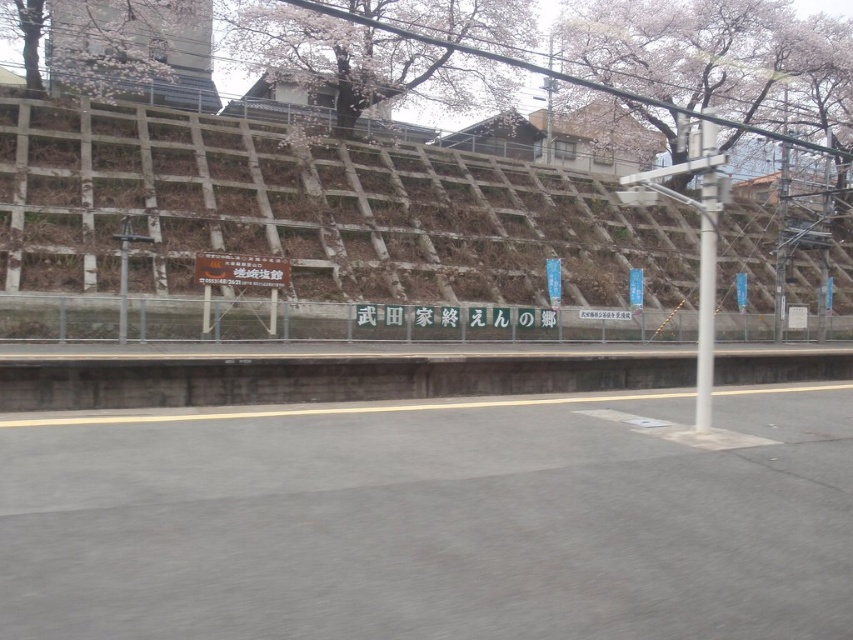
Does brown textured wall at upper center have a lesser width compared to slightly fuzzy cherry blossom at upper center?

Incorrect, brown textured wall at upper center's width is not less than slightly fuzzy cherry blossom at upper center's.

Who is higher up, brown textured wall at upper center or slightly fuzzy cherry blossom at upper center?

slightly fuzzy cherry blossom at upper center

This screenshot has height=640, width=853. What are the coordinates of `brown textured wall at upper center` in the screenshot? It's located at coord(315,212).

Between point (642, 109) and point (712, 204), which one is positioned in front?

Positioned in front is point (712, 204).

Who is higher up, slightly fuzzy cherry blossom at upper center or white metallic pole at center?

slightly fuzzy cherry blossom at upper center is higher up.

Where is `slightly fuzzy cherry blossom at upper center`? The width and height of the screenshot is (853, 640). slightly fuzzy cherry blossom at upper center is located at coordinates (701, 49).

This screenshot has width=853, height=640. I want to click on slightly fuzzy cherry blossom at upper center, so click(701, 49).

Which of these two, slightly fuzzy cherry blossom at upper center or slightly glossy wood at upper left, stands taller?

slightly fuzzy cherry blossom at upper center is taller.

Measure the distance between slightly fuzzy cherry blossom at upper center and camera.

slightly fuzzy cherry blossom at upper center and camera are 40.86 meters apart from each other.

Where is `slightly fuzzy cherry blossom at upper center`? slightly fuzzy cherry blossom at upper center is located at coordinates (701, 49).